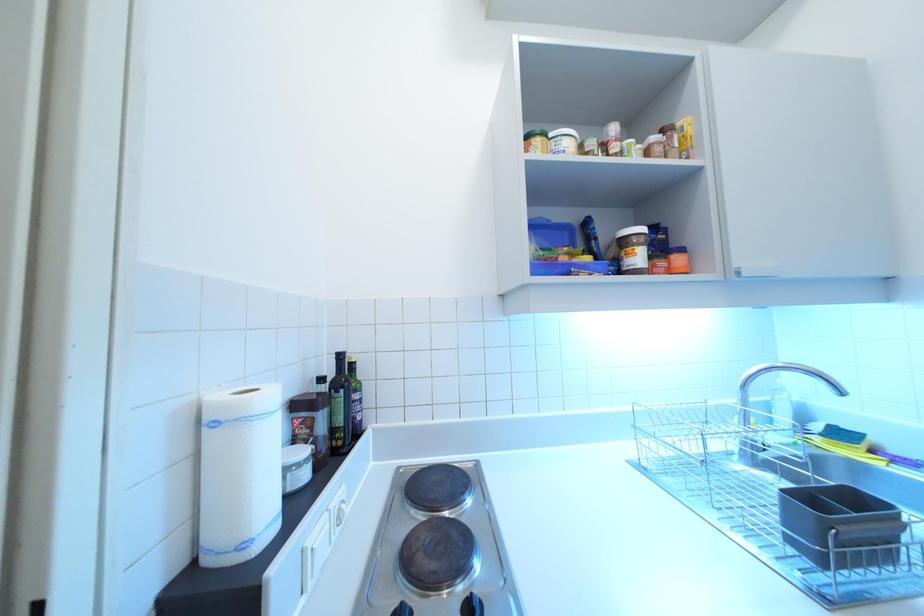
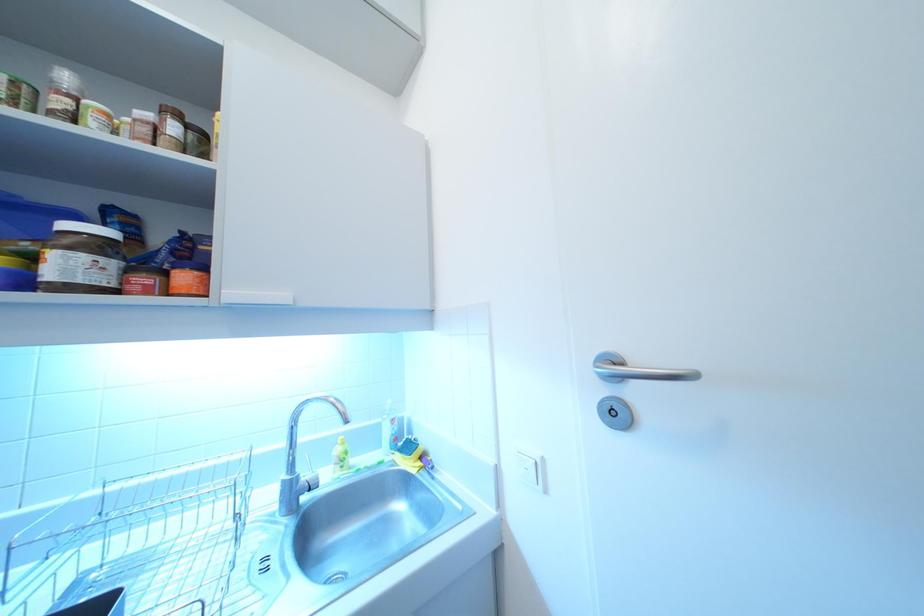
Question: The camera is either moving clockwise (left) or counter-clockwise (right) around the object. The first image is from the beginning of the video and the second image is from the end. Is the camera moving left or right when shooting the video?

Choices:
 (A) Left
 (B) Right

Answer: (A)